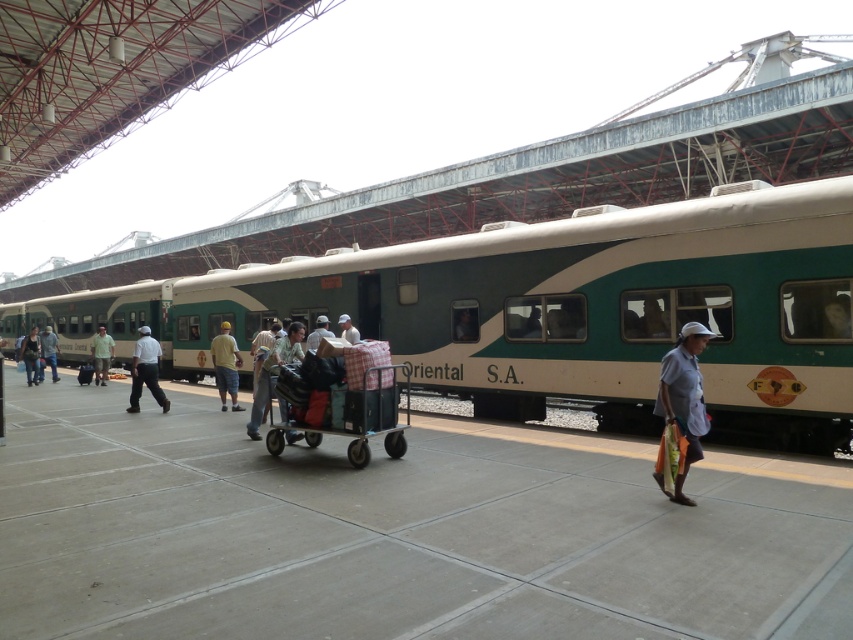
Is green matte train at center further to the viewer compared to light brown fabric pants at center?

That is False.

Is point (613, 275) closer to camera compared to point (271, 346)?

Yes, point (613, 275) is closer to viewer.

Find the location of a particular element. green matte train at center is located at coordinates (590, 308).

Is light brown fabric pants at center shorter than denim pants at left?

Correct, light brown fabric pants at center is not as tall as denim pants at left.

Does light brown fabric pants at center have a lesser width compared to denim pants at left?

Yes.

Who is more forward, (283,410) or (33,326)?

Positioned in front is point (283,410).

The image size is (853, 640). I want to click on light brown fabric pants at center, so click(260, 378).

Can you confirm if denim pants at left is shorter than light blue shirt at center?

No, denim pants at left is not shorter than light blue shirt at center.

Between point (35, 342) and point (312, 339), which one is positioned in front?

Positioned in front is point (312, 339).

Where is `denim pants at left`? denim pants at left is located at coordinates (30, 355).